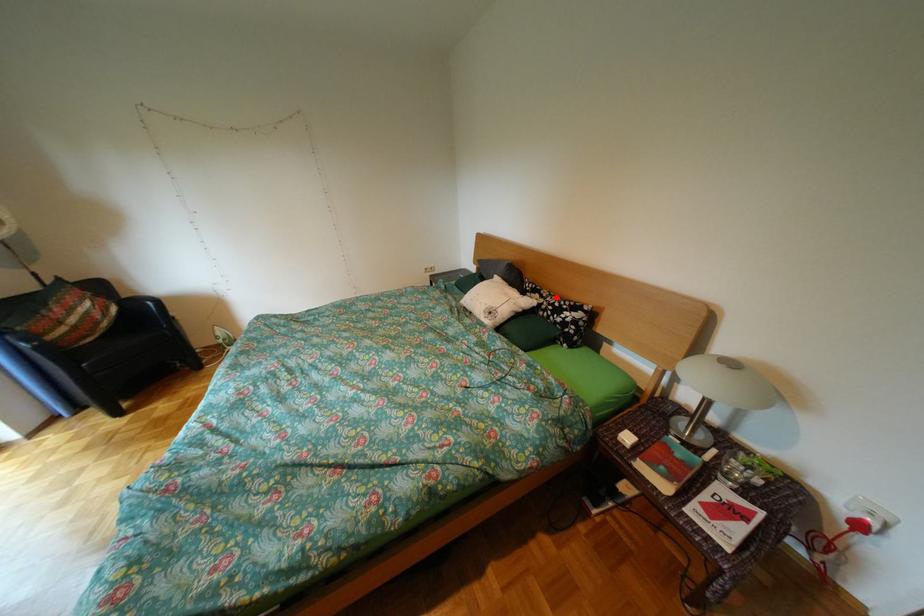
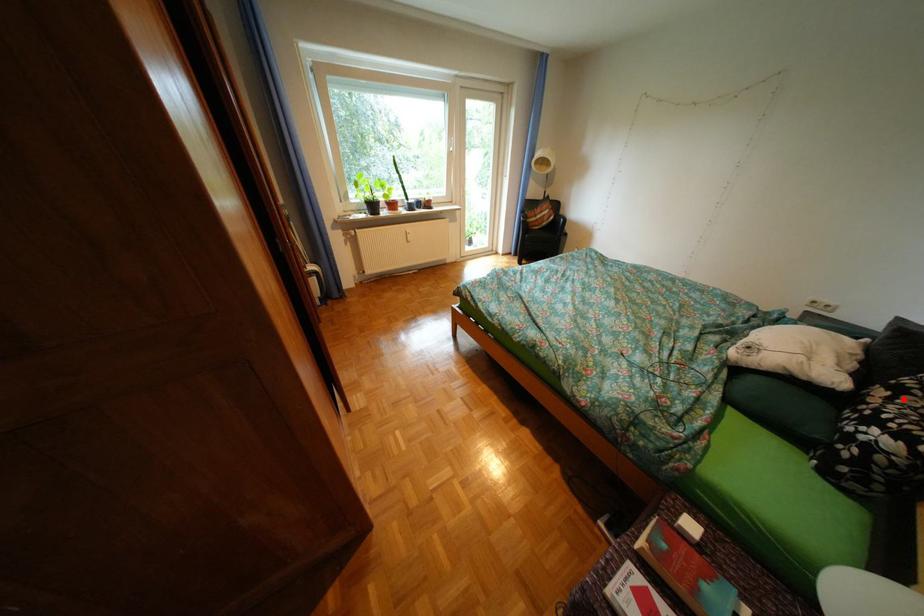
I am providing you with two images of the same scene from different viewpoints. A red point is marked on the first image and another point is marked on the second image. Is the red point in image1 aligned with the point shown in image2?

Yes